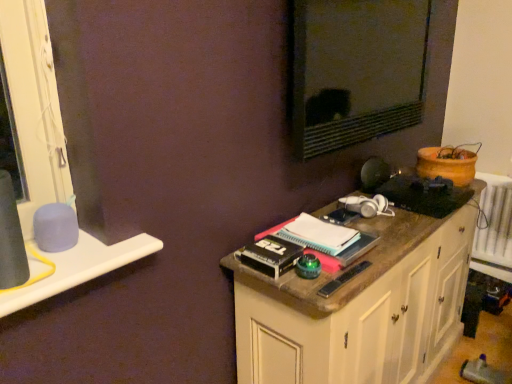
Question: From the image's perspective, is matte black mirror at upper center located above white plastic window sill at left?

Choices:
 (A) no
 (B) yes

Answer: (B)

Question: From a real-world perspective, is matte black mirror at upper center below white plastic window sill at left?

Choices:
 (A) yes
 (B) no

Answer: (B)

Question: From the image's perspective, is matte black mirror at upper center located beneath white plastic window sill at left?

Choices:
 (A) yes
 (B) no

Answer: (B)

Question: Is matte black mirror at upper center far from white plastic window sill at left?

Choices:
 (A) yes
 (B) no

Answer: (B)

Question: Is matte black mirror at upper center wider than white plastic window sill at left?

Choices:
 (A) yes
 (B) no

Answer: (B)

Question: From a real-world perspective, relative to matte black mirror at upper center, is white plastic window sill at left vertically above or below?

Choices:
 (A) above
 (B) below

Answer: (B)

Question: Is white plastic window sill at left inside the boundaries of matte black mirror at upper center, or outside?

Choices:
 (A) outside
 (B) inside

Answer: (A)

Question: Looking at their shapes, would you say white plastic window sill at left is wider or thinner than matte black mirror at upper center?

Choices:
 (A) wide
 (B) thin

Answer: (A)

Question: From the image's perspective, is white plastic window sill at left located above or below matte black mirror at upper center?

Choices:
 (A) above
 (B) below

Answer: (B)

Question: From a real-world perspective, is white plastic window sill at left above or below wooden cabinet at right?

Choices:
 (A) above
 (B) below

Answer: (A)

Question: Relative to wooden cabinet at right, is white plastic window sill at left in front or behind?

Choices:
 (A) behind
 (B) front

Answer: (B)

Question: Choose the correct answer: Is white plastic window sill at left inside wooden cabinet at right or outside it?

Choices:
 (A) inside
 (B) outside

Answer: (B)

Question: From their relative heights in the image, would you say white plastic window sill at left is taller or shorter than wooden cabinet at right?

Choices:
 (A) short
 (B) tall

Answer: (A)

Question: Is matte black mirror at upper center spatially inside wooden cabinet at right, or outside of it?

Choices:
 (A) outside
 (B) inside

Answer: (A)

Question: From a real-world perspective, is matte black mirror at upper center physically located above or below wooden cabinet at right?

Choices:
 (A) above
 (B) below

Answer: (A)